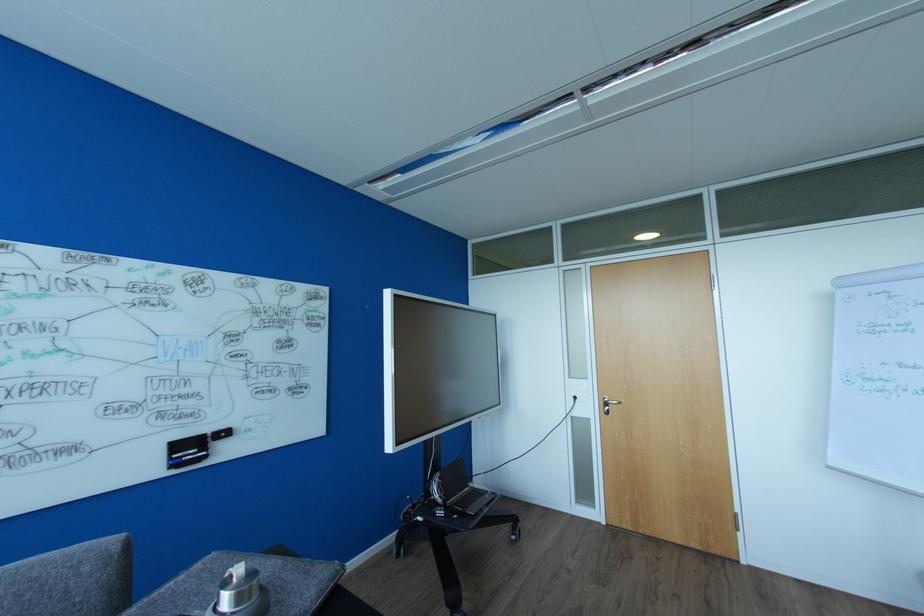
Find where to press the bottle top button. Please return your answer as a coordinate pair (x, y).

(239, 593)